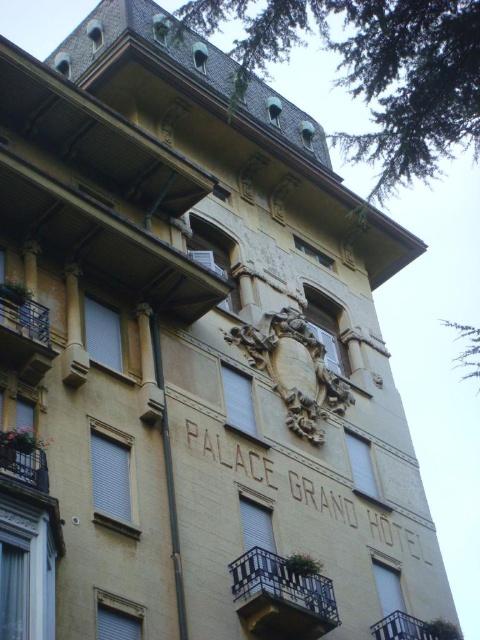
Is metallic blue balcony at left thinner than metallic balcony at lower right?

Yes.

Is point (11, 340) closer to viewer compared to point (387, 627)?

Yes, point (11, 340) is in front of point (387, 627).

Identify the location of metallic blue balcony at left. The image size is (480, 640). (24, 330).

Based on the photo, is rustic wrought iron balcony at center shorter than metallic balcony at lower right?

No.

Describe the element at coordinates (280, 596) in the screenshot. The width and height of the screenshot is (480, 640). I see `rustic wrought iron balcony at center` at that location.

Where is `rustic wrought iron balcony at center`? This screenshot has width=480, height=640. rustic wrought iron balcony at center is located at coordinates (280, 596).

Locate an element on the screen. The height and width of the screenshot is (640, 480). rustic wrought iron balcony at center is located at coordinates (280, 596).

Locate an element on the screen. This screenshot has height=640, width=480. rustic wrought iron balcony at center is located at coordinates (280, 596).

Does rustic wrought iron balcony at center come in front of rustic wrought iron balcony at lower left?

That is False.

Who is more forward, (294, 580) or (9, 456)?

Point (9, 456) is in front.

Identify the location of rustic wrought iron balcony at center. click(280, 596).